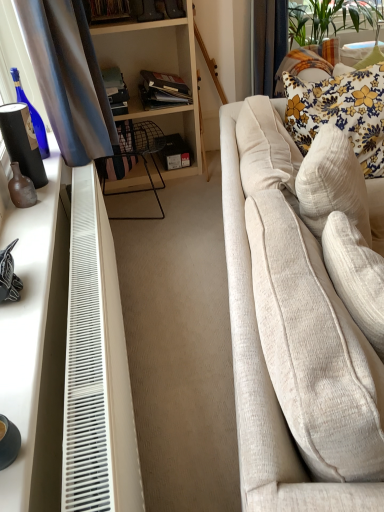
Question: Should I look upward or downward to see beige fabric couch at right?

Choices:
 (A) up
 (B) down

Answer: (A)

Question: Would you consider beige fabric couch at right to be distant from floral fabric pillow at upper right?

Choices:
 (A) no
 (B) yes

Answer: (A)

Question: Is the position of beige fabric couch at right less distant than that of floral fabric pillow at upper right?

Choices:
 (A) yes
 (B) no

Answer: (A)

Question: From a real-world perspective, is beige fabric couch at right on floral fabric pillow at upper right?

Choices:
 (A) yes
 (B) no

Answer: (B)

Question: Could floral fabric pillow at upper right be considered to be inside beige fabric couch at right?

Choices:
 (A) yes
 (B) no

Answer: (A)

Question: Considering the relative sizes of beige fabric couch at right and floral fabric pillow at upper right in the image provided, is beige fabric couch at right smaller than floral fabric pillow at upper right?

Choices:
 (A) yes
 (B) no

Answer: (B)

Question: Can you confirm if beige fabric couch at right is shorter than floral fabric pillow at upper right?

Choices:
 (A) yes
 (B) no

Answer: (B)

Question: Can you confirm if brown matte vase at left is wider than white matte desk at left?

Choices:
 (A) no
 (B) yes

Answer: (A)

Question: From a real-world perspective, is brown matte vase at left under white matte desk at left?

Choices:
 (A) yes
 (B) no

Answer: (B)

Question: From the image's perspective, would you say brown matte vase at left is shown under white matte desk at left?

Choices:
 (A) yes
 (B) no

Answer: (B)

Question: Is brown matte vase at left looking in the opposite direction of white matte desk at left?

Choices:
 (A) no
 (B) yes

Answer: (A)

Question: Is brown matte vase at left smaller than white matte desk at left?

Choices:
 (A) no
 (B) yes

Answer: (B)

Question: Is brown matte vase at left not near white matte desk at left?

Choices:
 (A) yes
 (B) no

Answer: (B)

Question: Does brown matte vase at left lie behind beige fabric couch at right?

Choices:
 (A) yes
 (B) no

Answer: (A)